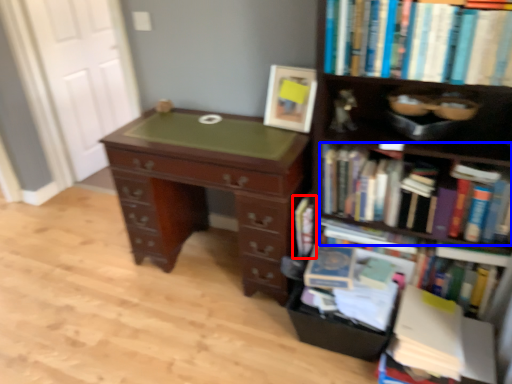
Question: Among these objects, which one is farthest to the camera, book (highlighted by a red box) or book (highlighted by a blue box)?

Choices:
 (A) book
 (B) book

Answer: (A)